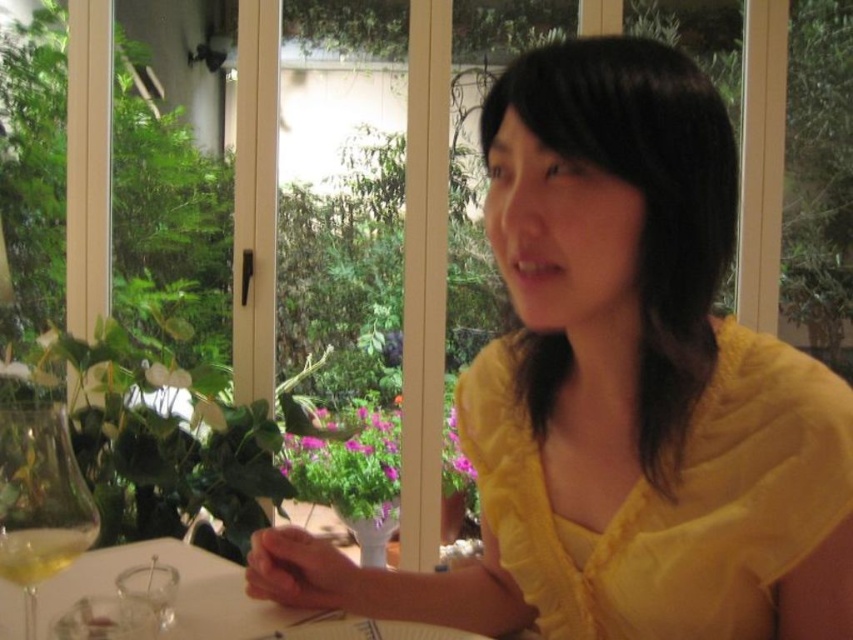
Is point (550, 611) in front of point (32, 481)?

That is False.

Can you confirm if yellow cotton dress at center is positioned above clear glass wine glass at lower left?

Yes, yellow cotton dress at center is above clear glass wine glass at lower left.

Who is more distant from viewer, [473,385] or [6,576]?

The point [473,385] is more distant.

I want to click on yellow cotton dress at center, so click(672, 499).

Can you confirm if yellow cotton dress at center is shorter than white glossy table at center?

No, yellow cotton dress at center is not shorter than white glossy table at center.

Which of these two, yellow cotton dress at center or white glossy table at center, stands taller?

Standing taller between the two is yellow cotton dress at center.

Describe the element at coordinates (672, 499) in the screenshot. I see `yellow cotton dress at center` at that location.

At what (x,y) coordinates should I click in order to perform the action: click on yellow cotton dress at center. Please return your answer as a coordinate pair (x, y). This screenshot has height=640, width=853. Looking at the image, I should click on (672, 499).

Between yellow fabric shirt at center and white glossy table at center, which one appears on the right side from the viewer's perspective?

Positioned to the right is yellow fabric shirt at center.

Who is more forward, (x=581, y=152) or (x=238, y=579)?

Point (x=581, y=152)

Locate an element on the screen. yellow fabric shirt at center is located at coordinates (621, 390).